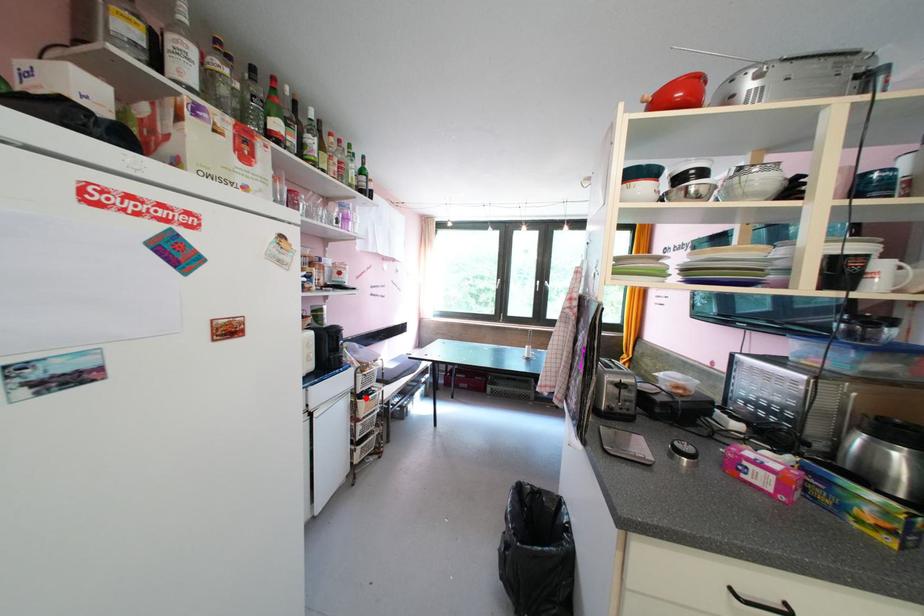
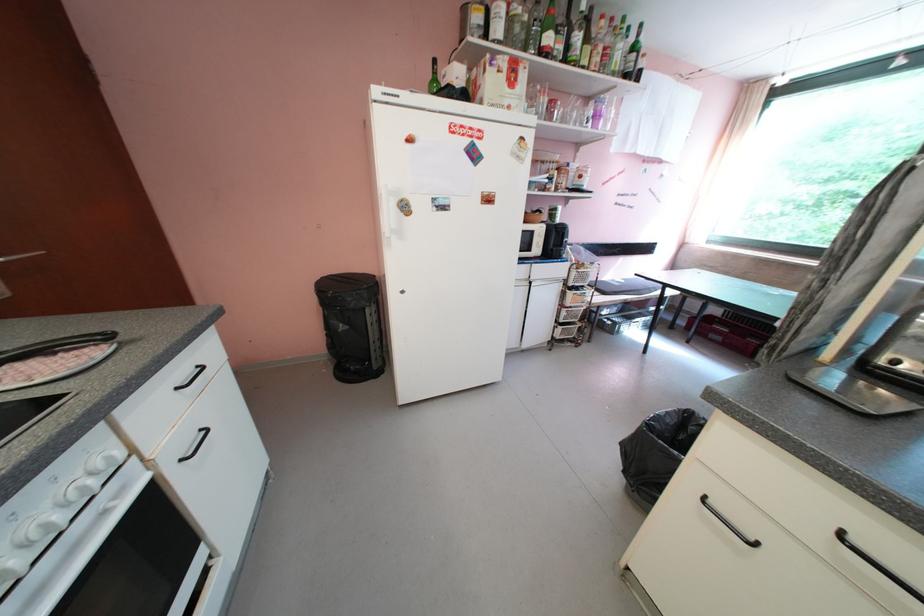
The point at the highlighted location is marked in the first image. Where is the corresponding point in the second image?

(576, 290)